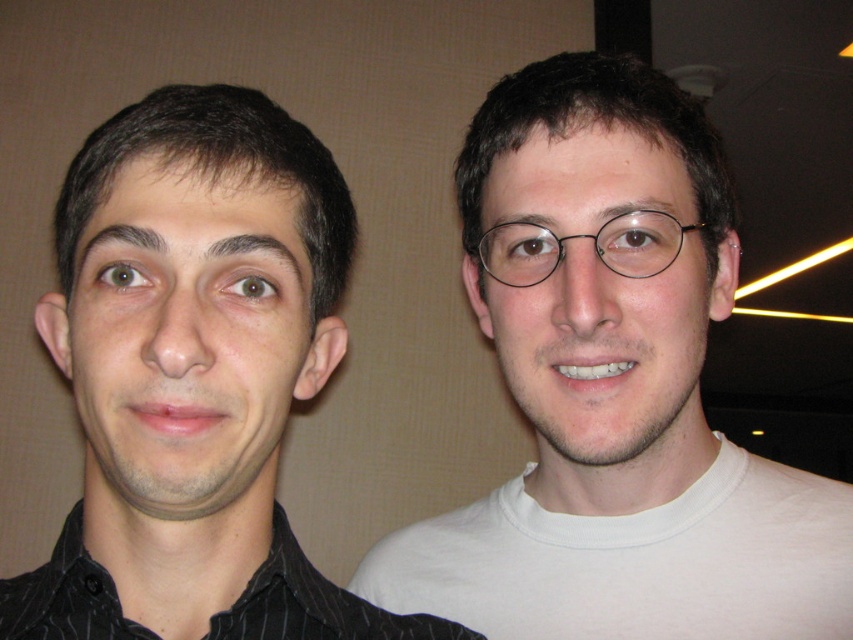
Based on the photo, you are trying to decide which item to pack for a trip. You have the black striped shirt at left and the clear skin glasses at right. If you want to bring the larger item, which one should you choose?

The black striped shirt at left is bigger than the clear skin glasses at right, so you should choose the black striped shirt at left.

You are a photographer setting up a portrait shoot. You need to ensure that the white matte shirt at right and the clear skin glasses at right are both visible in the frame. Given their positions, which object will require you to adjust the camera angle upwards more to keep it in focus?

The white matte shirt at right is taller than the clear skin glasses at right, so you will need to adjust the camera angle upwards more to keep the white matte shirt at right in focus.

You are a photographer setting up for a portrait session. You need to position a light source to the right of both subjects to evenly illuminate their faces. Given the positions of the white matte shirt at right and the clear skin glasses at right, which object should the light be placed to the right of to ensure both are lit properly?

The light should be placed to the right of the clear skin glasses at right because the white matte shirt at right is to the left of the clear skin glasses at right, making the glasses the furthest right object. Placing the light to the right of the glasses ensures it is positioned beyond both subjects for even lighting.